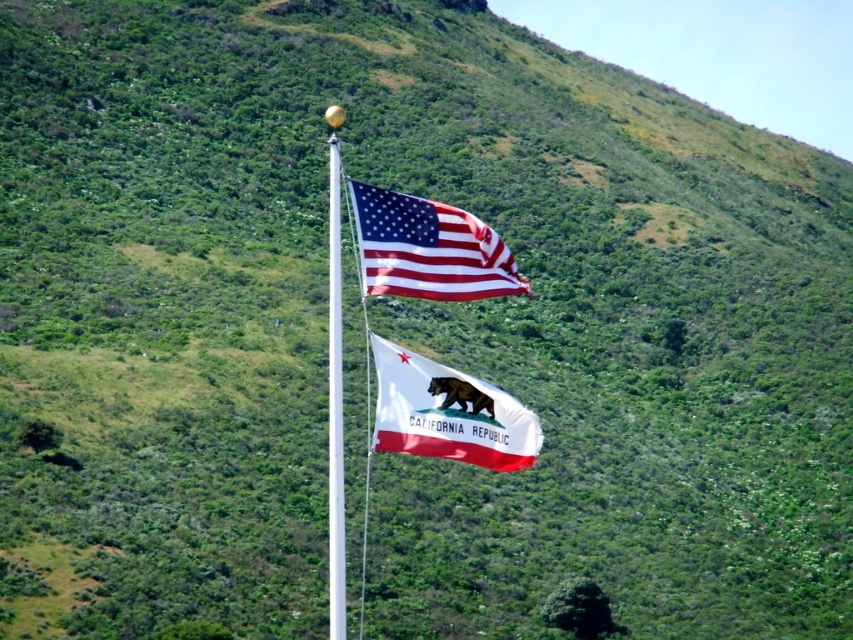
Question: Can you confirm if white fabric flag at center is wider than matte fabric flag at upper center?

Choices:
 (A) no
 (B) yes

Answer: (A)

Question: Does white fabric flag at center come in front of matte fabric flag at upper center?

Choices:
 (A) yes
 (B) no

Answer: (A)

Question: Which point is closer to the camera?

Choices:
 (A) matte fabric flag at upper center
 (B) white fabric flag at center

Answer: (B)

Question: Which object is positioned farthest from the matte fabric flag at upper center?

Choices:
 (A) white glossy flag pole at center
 (B) white fabric flag at center

Answer: (A)

Question: Is matte fabric flag at upper center further to camera compared to white glossy flag pole at center?

Choices:
 (A) no
 (B) yes

Answer: (B)

Question: Among these objects, which one is farthest from the camera?

Choices:
 (A) white glossy flag pole at center
 (B) matte fabric flag at upper center

Answer: (B)